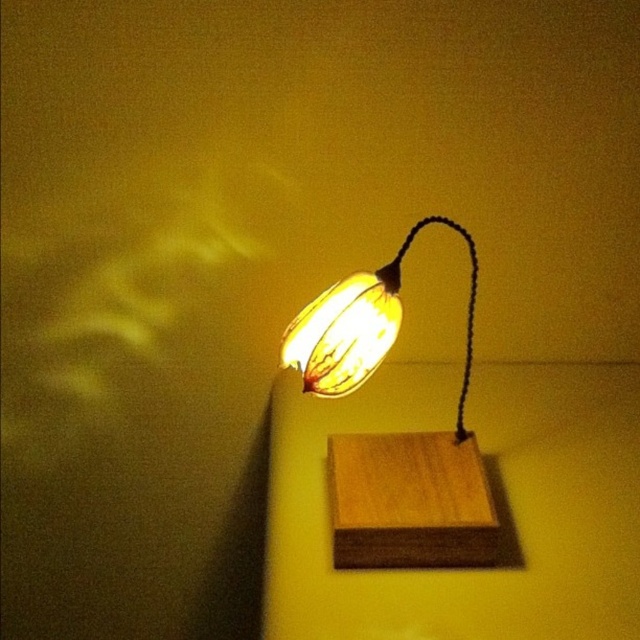
You are setting up a small table in your living room and want to ensure there is enough space between the wooden table lamp at center and the matte yellow lampshade at center. What is the minimum distance you should leave between them?

The minimum distance you should leave between the wooden table lamp at center and the matte yellow lampshade at center is 3.55 inches, as they are already positioned 3.55 inches apart.

You are setting up a small desk in your room and want to place both the wooden table lamp at center and the matte yellow lampshade at center on the desk. However, the desk has limited space. Based on their sizes, which object should you prioritize placing first to ensure both fit?

The wooden table lamp at center is bigger than the matte yellow lampshade at center, so you should prioritize placing the wooden table lamp at center first to ensure both fit on the desk.

You are sitting at a desk and notice the wooden table lamp at center and the matte yellow lampshade at center. Which object is physically closer to you?

The wooden table lamp at center is closer to the viewer than the matte yellow lampshade at center.